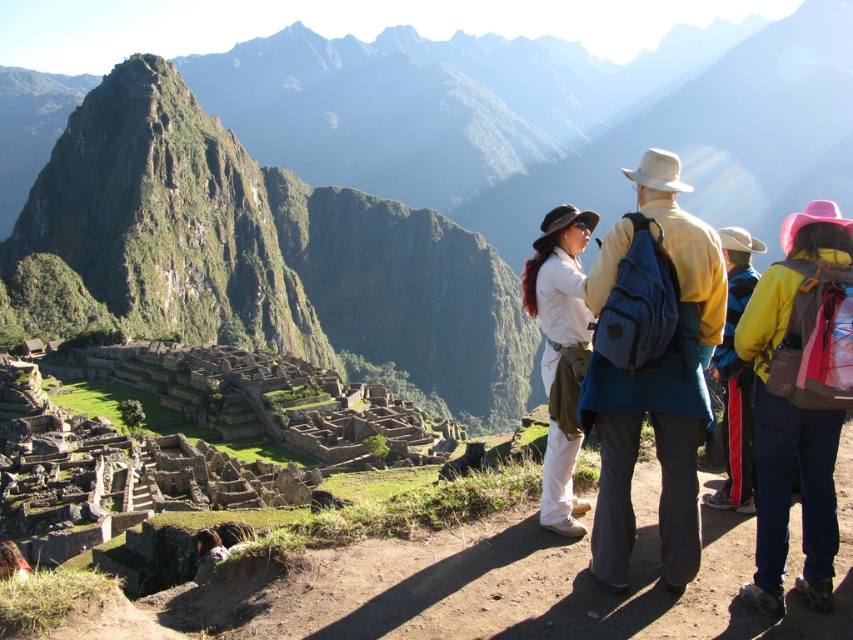
Question: Can you confirm if yellow fabric jacket at center right is bigger than white matte shirt at center?

Choices:
 (A) yes
 (B) no

Answer: (A)

Question: Which of the following is the farthest from the observer?

Choices:
 (A) matte blue backpack at center
 (B) white matte shirt at center
 (C) yellow fabric jacket at center right
 (D) yellow fabric pants at right

Answer: (B)

Question: Does green grassy mountain at center have a larger size compared to yellow fabric jacket at center right?

Choices:
 (A) no
 (B) yes

Answer: (B)

Question: Which object appears closest to the camera in this image?

Choices:
 (A) yellow fabric pants at right
 (B) white matte shirt at center
 (C) yellow fabric jacket at center right

Answer: (C)

Question: Is green grassy mountain at center behind white matte shirt at center?

Choices:
 (A) no
 (B) yes

Answer: (A)

Question: Which object is farther from the camera taking this photo?

Choices:
 (A) matte blue backpack at center
 (B) white matte shirt at center
 (C) yellow fabric jacket at center right

Answer: (B)